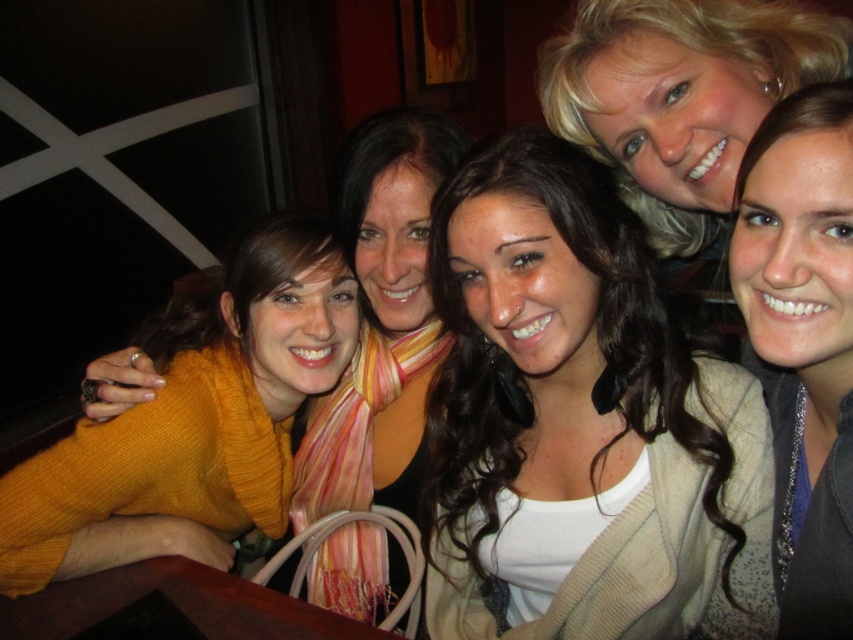
Can you confirm if white matte shirt at center is positioned to the left of matte gray sweater at upper right?

Indeed, white matte shirt at center is positioned on the left side of matte gray sweater at upper right.

From the picture: Which of these two, white matte shirt at center or matte gray sweater at upper right, stands taller?

white matte shirt at center is taller.

I want to click on white matte shirt at center, so click(x=579, y=412).

Consider the image. Which is below, white matte shirt at center or matte yellow sweater at left?

matte yellow sweater at left

In order to click on white matte shirt at center in this screenshot , I will do `click(579, 412)`.

Is matte yellow sweater at left bigger than matte gray sweater at upper right?

Answer: Indeed, matte yellow sweater at left has a larger size compared to matte gray sweater at upper right.

In order to click on matte yellow sweater at left in this screenshot , I will do `click(196, 410)`.

Locate an element on the screen. matte yellow sweater at left is located at coordinates (196, 410).

The width and height of the screenshot is (853, 640). I want to click on matte yellow sweater at left, so click(x=196, y=410).